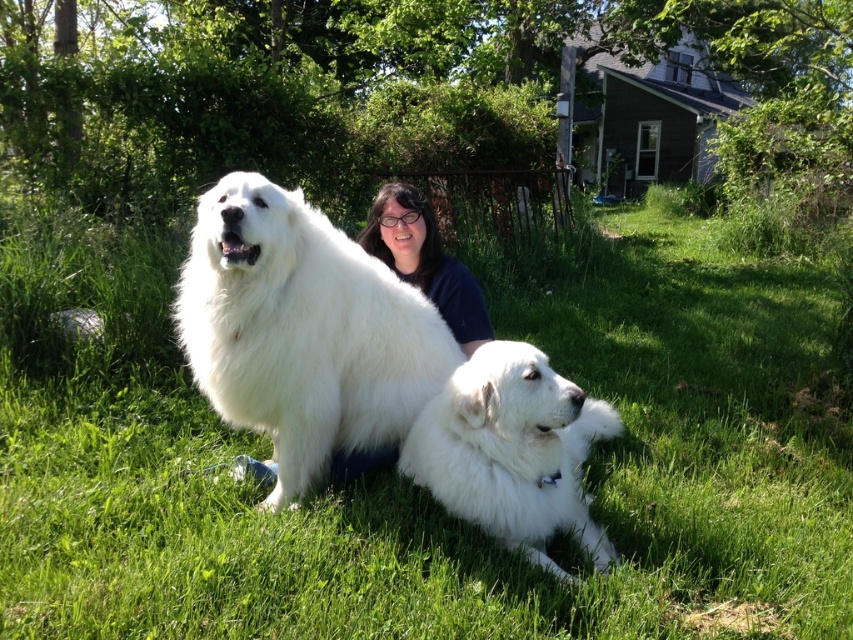
Question: Which point is closer to the camera?

Choices:
 (A) (543, 371)
 (B) (154, 609)
 (C) (387, 257)

Answer: (B)

Question: Is white fluffy dog at center to the right of dark blue shirt at center from the viewer's perspective?

Choices:
 (A) yes
 (B) no

Answer: (B)

Question: Which of these objects is positioned closest to the white fluffy dog at center?

Choices:
 (A) green grass at center
 (B) white fluffy dog at lower center
 (C) dark blue shirt at center

Answer: (B)

Question: Can you confirm if white fluffy dog at center is bigger than dark blue shirt at center?

Choices:
 (A) yes
 (B) no

Answer: (A)

Question: Does green grass at center have a greater width compared to white fluffy dog at center?

Choices:
 (A) yes
 (B) no

Answer: (B)

Question: Which of these objects is positioned closest to the white fluffy dog at center?

Choices:
 (A) dark blue shirt at center
 (B) white fluffy dog at lower center

Answer: (B)